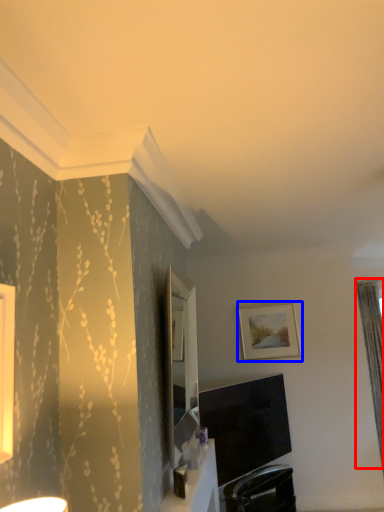
Question: Which of the following is the closest to the observer, curtain (highlighted by a red box) or picture frame (highlighted by a blue box)?

Choices:
 (A) curtain
 (B) picture frame

Answer: (B)